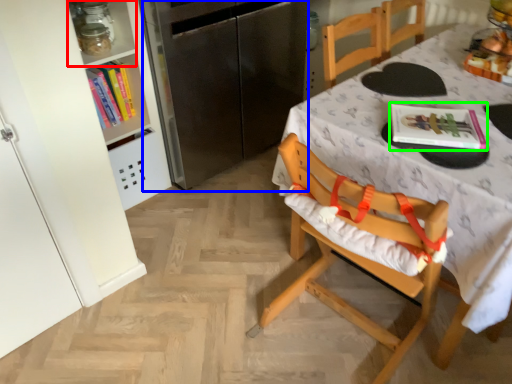
Question: Considering the real-world distances, which object is farthest from shelf (highlighted by a red box)? appliance (highlighted by a blue box) or magazine (highlighted by a green box)?

Choices:
 (A) appliance
 (B) magazine

Answer: (B)